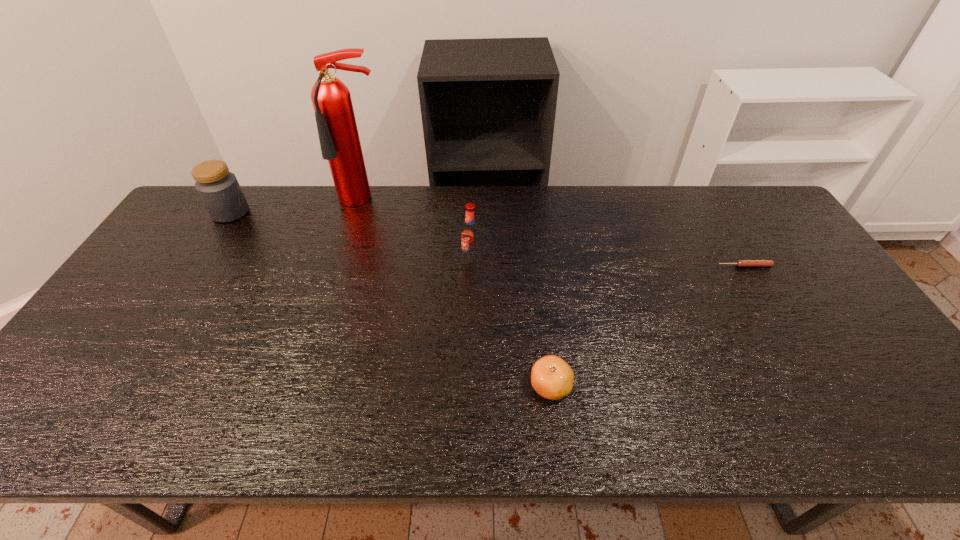
Locate an element on the screen. This screenshot has width=960, height=540. vacant space that is in between the root beer and the fire extinguisher is located at coordinates pos(418,230).

At what (x,y) coordinates should I click in order to perform the action: click on free space between the fourth object from left to right and the leftmost object. Please return your answer as a coordinate pair (x, y). This screenshot has height=540, width=960. Looking at the image, I should click on (391, 299).

This screenshot has height=540, width=960. I want to click on free space between the fire extinguisher and the sausage, so click(555, 234).

Locate an element on the screen. free space between the clementine and the jar is located at coordinates (391, 299).

Where is `object identified as the third closest to the jar`? object identified as the third closest to the jar is located at coordinates (552, 378).

Identify the location of object that is the closest to the third object from right to left. (339, 139).

You are a GUI agent. You are given a task and a screenshot of the screen. Output one action in this format:
    pyautogui.click(x=<x>, y=<y>)
    Task: Click on the free space that satisfies the following two spatial constraints: 1. at the nozzle of the fourth tallest object; 2. on the left side of the second object from left to right
    
    Given the screenshot: What is the action you would take?
    pyautogui.click(x=308, y=386)

Identify the location of vacant point that satisfies the following two spatial constraints: 1. at the nozzle of the tallest object; 2. on the surface of the leftmost object near the warning symbol. (361, 212).

This screenshot has width=960, height=540. Identify the location of vacant space that satisfies the following two spatial constraints: 1. at the nozzle of the fire extinguisher; 2. on the right side of the third object from right to left. (347, 259).

Image resolution: width=960 pixels, height=540 pixels. In order to click on vacant space that satisfies the following two spatial constraints: 1. on the surface of the sausage near the warning symbol; 2. on the left side of the jar in this screenshot , I will do `click(197, 266)`.